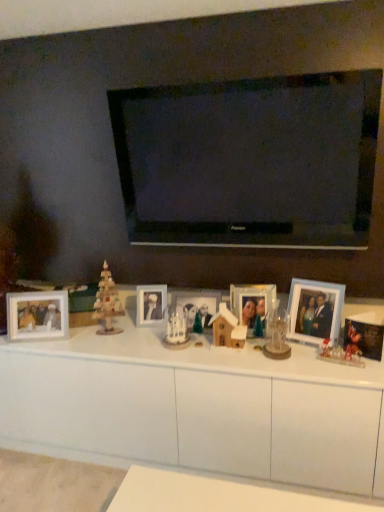
Image resolution: width=384 pixels, height=512 pixels. Identify the location of free space in front of wooden house at center, the first toy in the left-to-right sequence. (x=231, y=361).